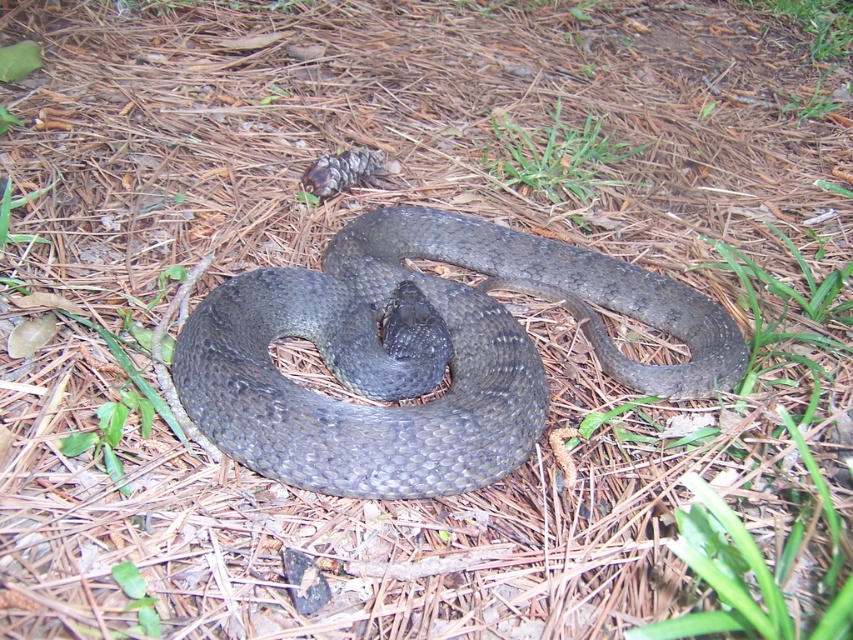
Question: Does shiny dark gray snake at center have a lesser width compared to green soft grass at upper center?

Choices:
 (A) no
 (B) yes

Answer: (A)

Question: Can you confirm if shiny dark gray snake at center is positioned below green soft grass at upper center?

Choices:
 (A) no
 (B) yes

Answer: (B)

Question: Which object is closer to the camera taking this photo?

Choices:
 (A) green soft grass at upper center
 (B) shiny dark gray snake at center

Answer: (B)

Question: Is shiny dark gray snake at center above green soft grass at upper center?

Choices:
 (A) yes
 (B) no

Answer: (B)